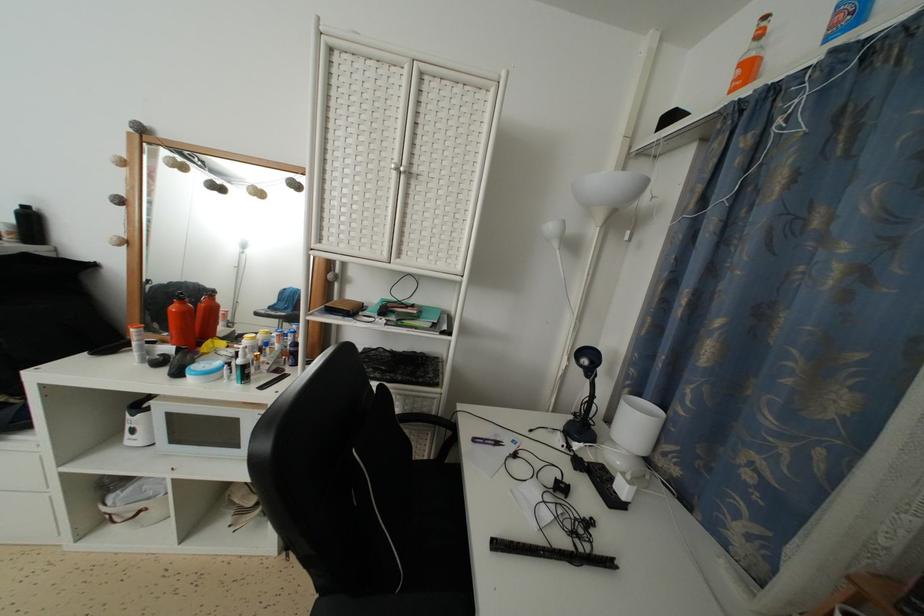
The location [630,444] corresponds to which object?

This point indicates the white blender.